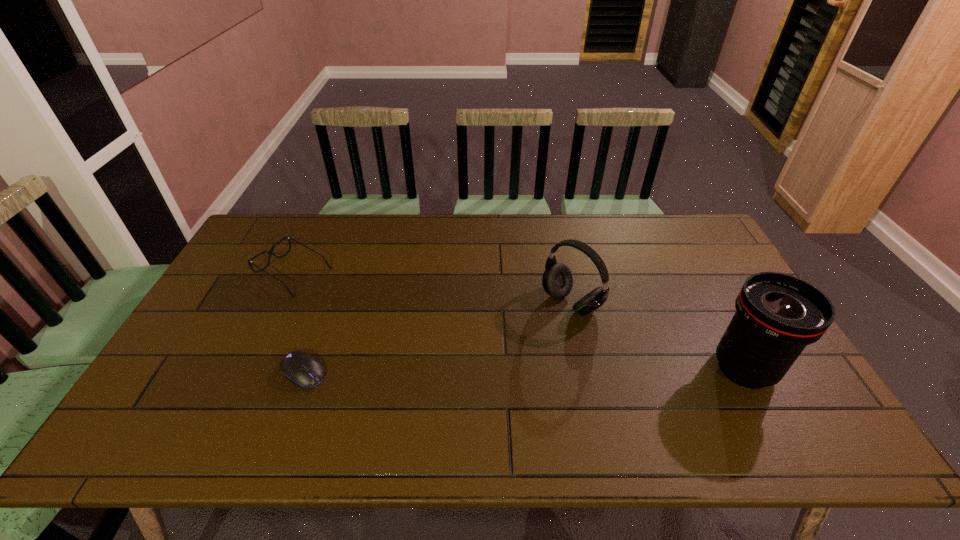
In the image, there is a desktop. Where is `vacant region at the far edge`? The image size is (960, 540). vacant region at the far edge is located at coordinates (420, 248).

The width and height of the screenshot is (960, 540). In order to click on free space at the near edge of the desktop in this screenshot , I will do `click(412, 392)`.

Where is `vacant position at the left edge of the desktop`? vacant position at the left edge of the desktop is located at coordinates (226, 298).

In the image, there is a desktop. What are the coordinates of `vacant space at the right edge` in the screenshot? It's located at [x=707, y=296].

In the image, there is a desktop. Where is `free space at the far right corner`? The height and width of the screenshot is (540, 960). free space at the far right corner is located at coordinates (693, 240).

The height and width of the screenshot is (540, 960). What are the coordinates of `free region at the near right corner` in the screenshot? It's located at (772, 388).

You are a GUI agent. You are given a task and a screenshot of the screen. Output one action in this format:
    pyautogui.click(x=<x>, y=<y>)
    Task: Click on the unoccupied area between the second tallest object and the computer mouse
    
    Given the screenshot: What is the action you would take?
    [438, 338]

The height and width of the screenshot is (540, 960). Find the location of `free space between the third tallest object and the second object from right to left`. free space between the third tallest object and the second object from right to left is located at coordinates (433, 288).

Where is `vacant area that lies between the spectacles and the shortest object`? Image resolution: width=960 pixels, height=540 pixels. vacant area that lies between the spectacles and the shortest object is located at coordinates (299, 322).

Identify the location of unoccupied position between the computer mouse and the third tallest object. (299, 322).